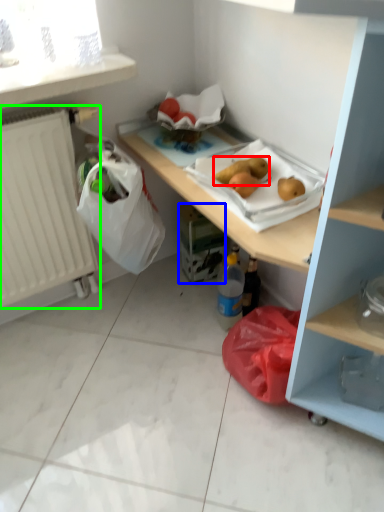
Question: Which object is positioned farthest from food (highlighted by a red box)? Select from carton (highlighted by a blue box) and radiator (highlighted by a green box).

Choices:
 (A) carton
 (B) radiator

Answer: (B)